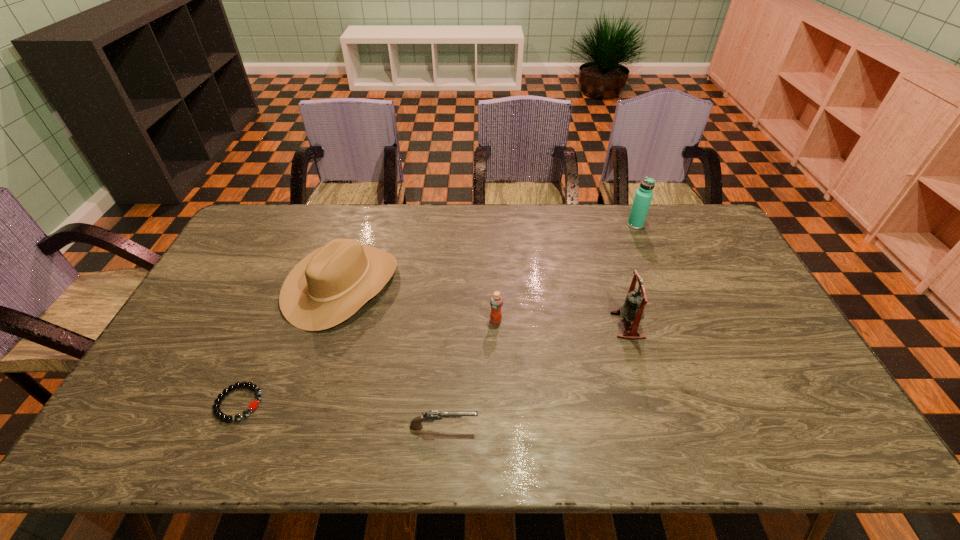
Where is `the farthest object`? the farthest object is located at coordinates (643, 196).

The width and height of the screenshot is (960, 540). Identify the location of thermos bottle. (643, 196).

Image resolution: width=960 pixels, height=540 pixels. In order to click on bell in this screenshot , I will do `click(633, 308)`.

Locate an element on the screen. the fourth shortest object is located at coordinates (329, 285).

In order to click on the third object from right to left in this screenshot , I will do click(496, 301).

Locate an element on the screen. Image resolution: width=960 pixels, height=540 pixels. orange juice is located at coordinates (496, 301).

At what (x,y) coordinates should I click in order to perform the action: click on gun. Please return your answer as a coordinate pair (x, y). Looking at the image, I should click on (429, 416).

Where is `the second shortest object`? This screenshot has height=540, width=960. the second shortest object is located at coordinates (429, 416).

You are a GUI agent. You are given a task and a screenshot of the screen. Output one action in this format:
    pyautogui.click(x=<x>, y=<y>)
    Task: Click on the bracelet
    
    Given the screenshot: What is the action you would take?
    pyautogui.click(x=253, y=405)

Where is `blank area located on the right of the farthest object`? blank area located on the right of the farthest object is located at coordinates (708, 225).